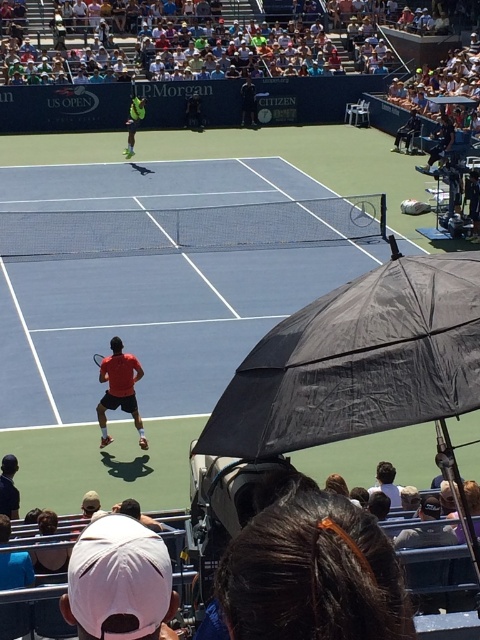
You are a photographer at the US Open tennis match. You need to capture a closeup shot of the dark brown leather jacket at lower left and the dark blue shirt at lower left. Which object will require a wider angle to fully capture in the frame?

The dark blue shirt at lower left requires a wider angle to fully capture because it occupies more space than the dark brown leather jacket at lower left.

In the scene shown: You are a photographer at the US Open. You need to capture a photo where the red matte tennis player at lower left and the green fabric tennis outfit at upper center are both visible. Considering their heights, which player should you position closer to the camera to ensure both are fully visible in the frame?

The red matte tennis player at lower left is taller than the green fabric tennis outfit at upper center. To ensure both are fully visible, position the red matte tennis player at lower left closer to the camera so their height doesn

From the picture: You are a photographer at the US Open tennis match. You need to capture a photo of both the dark brown leather jacket at lower left and the dark blue shirt at lower left. Which object should you focus on first to ensure both are in frame?

The dark brown leather jacket at lower left is shorter than the dark blue shirt at lower left. To ensure both are in frame, focus on the shorter object first, which is the dark brown leather jacket at lower left, then adjust to include the taller dark blue shirt at lower left.